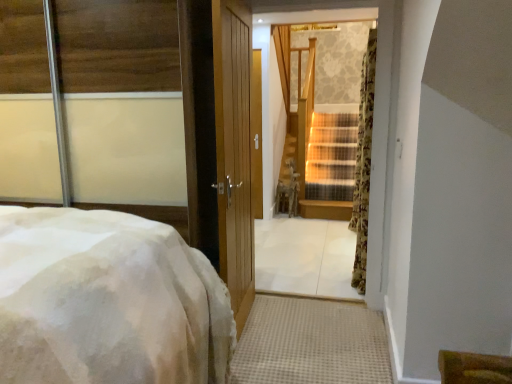
Question: Is point (292, 79) positioned closer to the camera than point (77, 296)?

Choices:
 (A) closer
 (B) farther

Answer: (B)

Question: From a real-world perspective, is wooden staircase at center above or below white fluffy bed at left?

Choices:
 (A) below
 (B) above

Answer: (B)

Question: Which is farther from the floral fabric curtain at right?

Choices:
 (A) wooden staircase at center
 (B) white fluffy bed at left

Answer: (A)

Question: Which object is positioned closest to the floral fabric curtain at right?

Choices:
 (A) white fluffy bed at left
 (B) wooden staircase at center

Answer: (A)